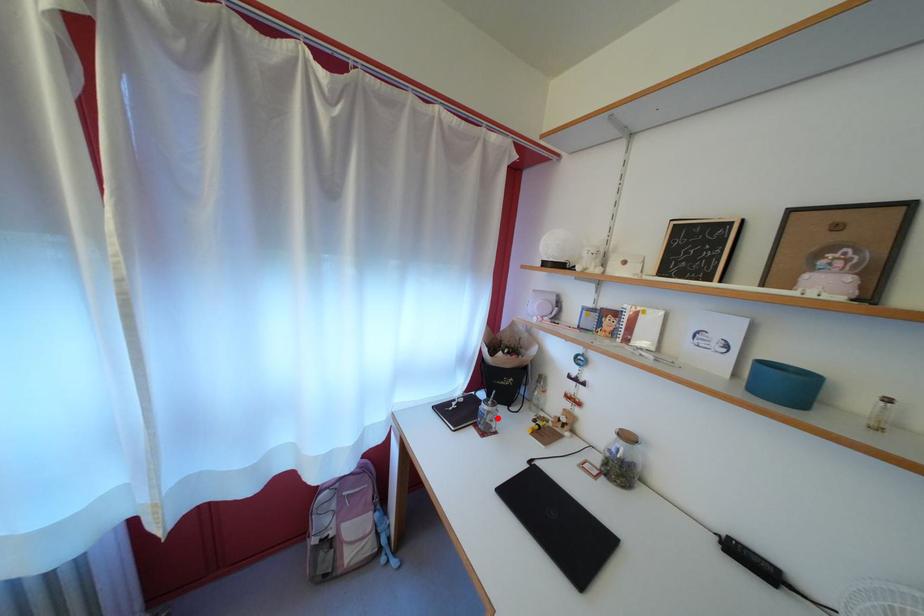
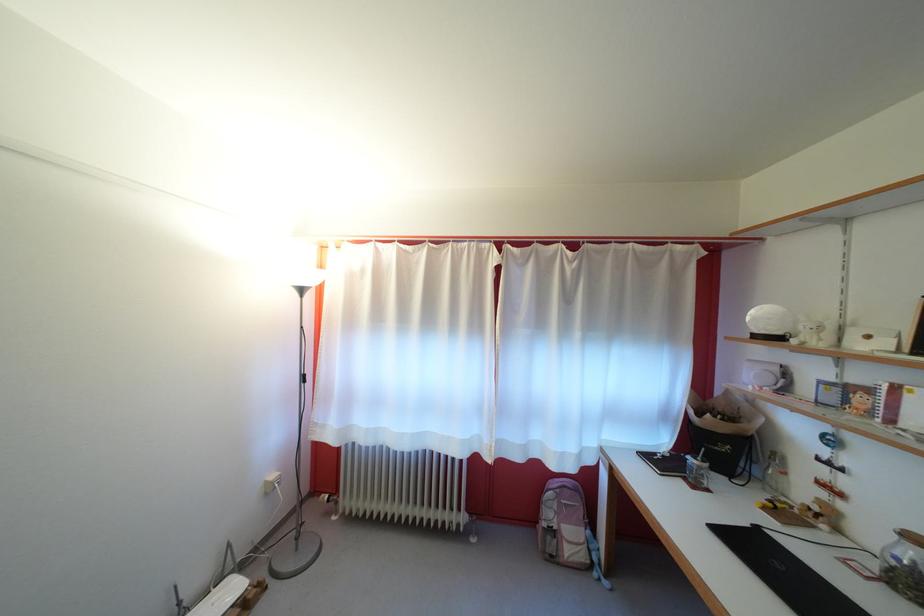
Where in the second image is the point corresponding to the highlighted location from the first image?

(708, 474)